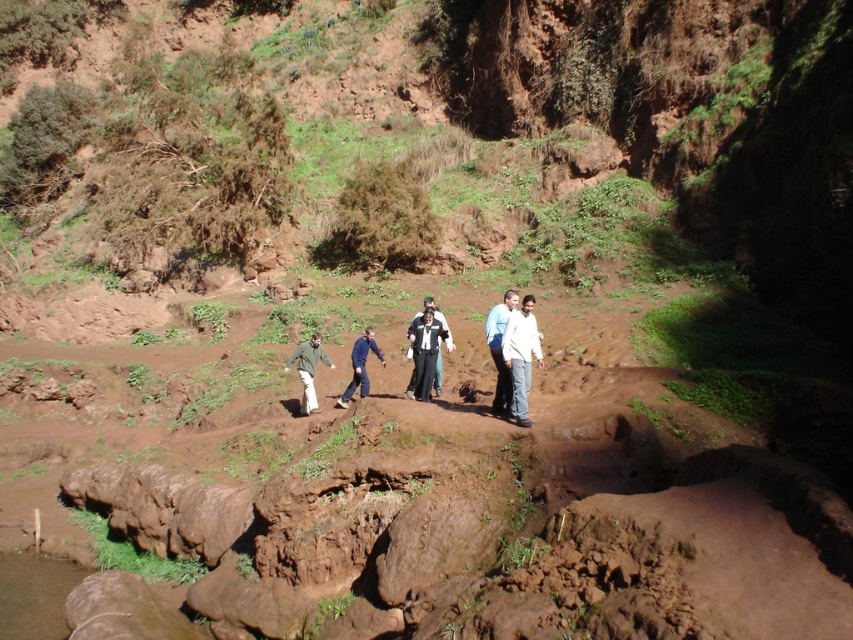
You are a hiker planning to cross the rocky terrain shown in the image. You notice the point marked at coordinates (424, 353). What object is located at this point?

The point at coordinates (424, 353) marks the location of the black matte pants at center.

You are standing at the point labeled point (505, 397) and want to walk to the nearest rocky area. The rocky area is 10 meters away from you. Can you reach the rocky area without walking more than 10 meters?

The distance between point (505, 397) and the viewer is 11.43 meters, which is more than 10 meters. Therefore, you cannot reach the rocky area within 10 meters.